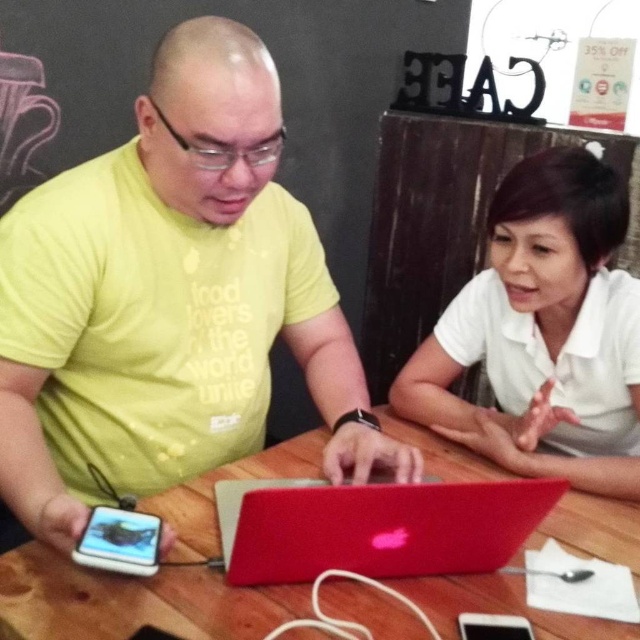
You are standing in front of the wooden table in the image. There are two points marked on the table surface. One is at coordinates point (x=504, y=240) and the other is at point (x=534, y=500). Which point is closer to you?

Point (x=504, y=240) is closer to you because it is further to the viewer than point (x=534, y=500).

You are a delivery robot that needs to place a small package between the white matte shirt at center and the metallic red laptop at center. The package is 16 inches long. Can you fit it in the space between them?

The space between the white matte shirt at center and the metallic red laptop at center is 15.97 inches, which is slightly less than the 16 inches required for the package. Therefore, the package cannot fit in the space between them.